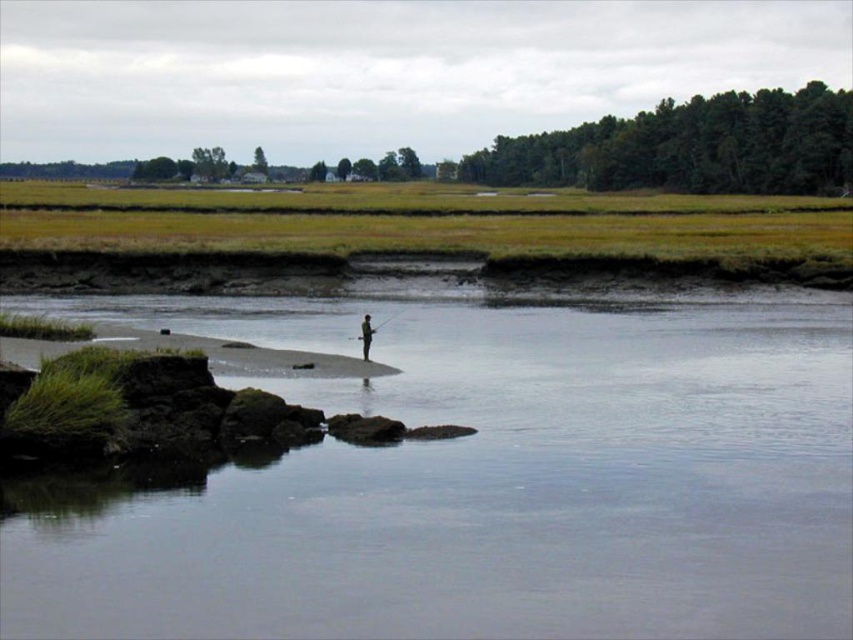
You are a photographer trying to capture the clear water at center and the light brown wooden pole at center in the same frame. Which object will appear bigger in your photo?

The clear water at center will appear bigger in the photo because it has a larger size compared to the light brown wooden pole at center.

In the scene shown: You are standing at the riverside and see two points marked on the image. Which point is closer to you, point [529,397] or point [364,332]?

Point [529,397] is in front of point [364,332], so it is closer to you.

You are a photographer trying to capture the reflection of the light brown wooden pole at center in the clear water at center. Based on the scene, can you confirm if the reflection will be fully visible in the water?

The clear water at center has a greater height compared to light brown wooden pole at center, so the reflection of the light brown wooden pole at center will be fully visible in the clear water at center.